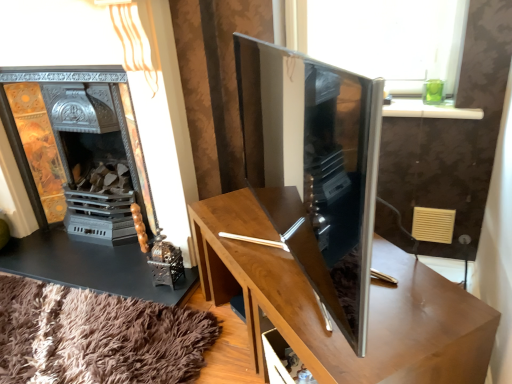
Question: Can you confirm if satin wood tv cabinet at center is bigger than wooden table at center?

Choices:
 (A) no
 (B) yes

Answer: (A)

Question: Is satin wood tv cabinet at center further to the viewer compared to wooden table at center?

Choices:
 (A) no
 (B) yes

Answer: (A)

Question: Considering the relative sizes of satin wood tv cabinet at center and wooden table at center in the image provided, is satin wood tv cabinet at center wider than wooden table at center?

Choices:
 (A) no
 (B) yes

Answer: (A)

Question: Considering the relative sizes of satin wood tv cabinet at center and wooden table at center in the image provided, is satin wood tv cabinet at center smaller than wooden table at center?

Choices:
 (A) no
 (B) yes

Answer: (B)

Question: From a real-world perspective, does satin wood tv cabinet at center sit lower than wooden table at center?

Choices:
 (A) no
 (B) yes

Answer: (A)

Question: Considering the positions of point (91, 77) and point (325, 165), is point (91, 77) closer or farther from the camera than point (325, 165)?

Choices:
 (A) farther
 (B) closer

Answer: (A)

Question: In terms of width, does metallic ornate fireplace at left look wider or thinner when compared to satin wood tv cabinet at center?

Choices:
 (A) wide
 (B) thin

Answer: (A)

Question: From a real-world perspective, is metallic ornate fireplace at left physically located above or below satin wood tv cabinet at center?

Choices:
 (A) below
 (B) above

Answer: (A)

Question: Considering their positions, is metallic ornate fireplace at left located in front of or behind satin wood tv cabinet at center?

Choices:
 (A) behind
 (B) front

Answer: (A)

Question: Considering the positions of satin wood tv cabinet at center and metallic ornate fireplace at left in the image, is satin wood tv cabinet at center wider or thinner than metallic ornate fireplace at left?

Choices:
 (A) thin
 (B) wide

Answer: (A)

Question: Considering their positions, is satin wood tv cabinet at center located in front of or behind metallic ornate fireplace at left?

Choices:
 (A) behind
 (B) front

Answer: (B)

Question: Is point (313, 284) closer or farther from the camera than point (78, 203)?

Choices:
 (A) closer
 (B) farther

Answer: (A)

Question: Is satin wood tv cabinet at center spatially inside metallic ornate fireplace at left, or outside of it?

Choices:
 (A) inside
 (B) outside

Answer: (B)

Question: Is wooden table at center taller or shorter than satin wood tv cabinet at center?

Choices:
 (A) tall
 (B) short

Answer: (B)

Question: Is wooden table at center in front of or behind satin wood tv cabinet at center in the image?

Choices:
 (A) front
 (B) behind

Answer: (B)